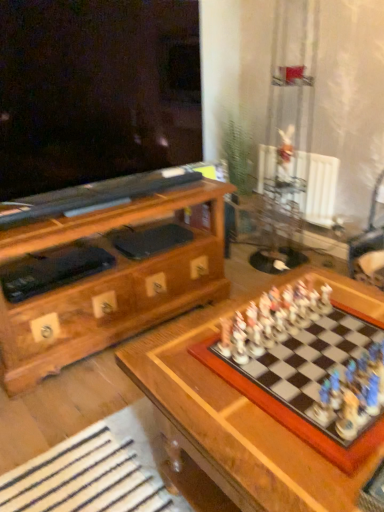
Locate an element on the screen. free spot below white plastic radiator at upper right (from a real-world perspective) is located at coordinates (301, 244).